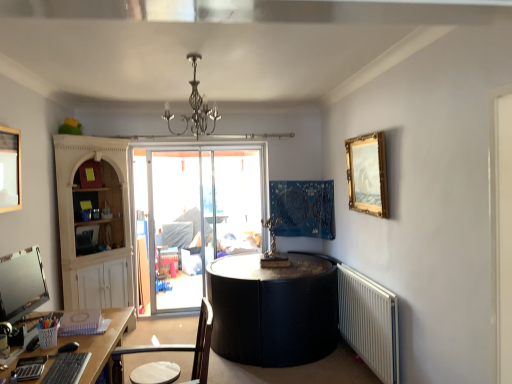
You are a GUI agent. You are given a task and a screenshot of the screen. Output one action in this format:
    pyautogui.click(x=<x>, y=<y>)
    Task: Click on the empty space that is ontop of metallic chandelier at upper center (from a real-world perspective)
    Image resolution: width=512 pixels, height=384 pixels.
    Given the screenshot: What is the action you would take?
    pyautogui.click(x=189, y=57)